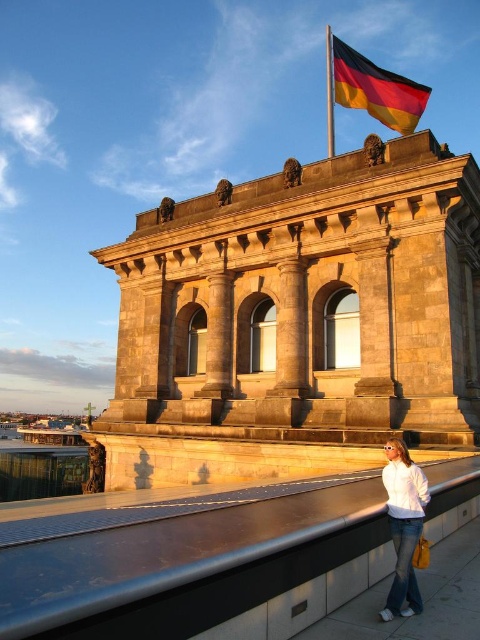
How much distance is there between polished fabric flag at upper center and white matte shirt at lower right?

polished fabric flag at upper center and white matte shirt at lower right are 168.74 feet apart from each other.

Is point (342, 65) positioned behind point (412, 502)?

Yes, it is behind point (412, 502).

Image resolution: width=480 pixels, height=640 pixels. Identify the location of polished fabric flag at upper center. (373, 88).

Is point (86, 548) less distant than point (365, 106)?

Yes, point (86, 548) is closer to viewer.

Which is in front, point (377, 497) or point (368, 99)?

Point (377, 497) is more forward.

The height and width of the screenshot is (640, 480). What are the coordinates of `metallic gray balustrade at lower center` in the screenshot? It's located at (202, 572).

Which is more to the right, metallic gray balustrade at lower center or white matte shirt at lower right?

white matte shirt at lower right

Is metallic gray balustrade at lower center bigger than white matte shirt at lower right?

Yes, metallic gray balustrade at lower center is bigger than white matte shirt at lower right.

Measure the distance between point (131, 596) and camera.

Point (131, 596) and camera are 14.56 meters apart.

This screenshot has height=640, width=480. Find the location of `metallic gray balustrade at lower center`. metallic gray balustrade at lower center is located at coordinates (202, 572).